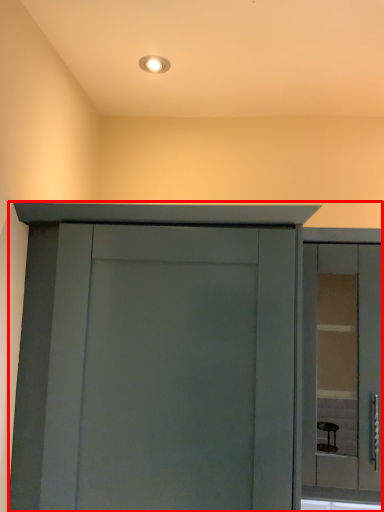
Question: From the image's perspective, where is cupboard (annotated by the red box) located in relation to window in the image?

Choices:
 (A) above
 (B) below

Answer: (B)